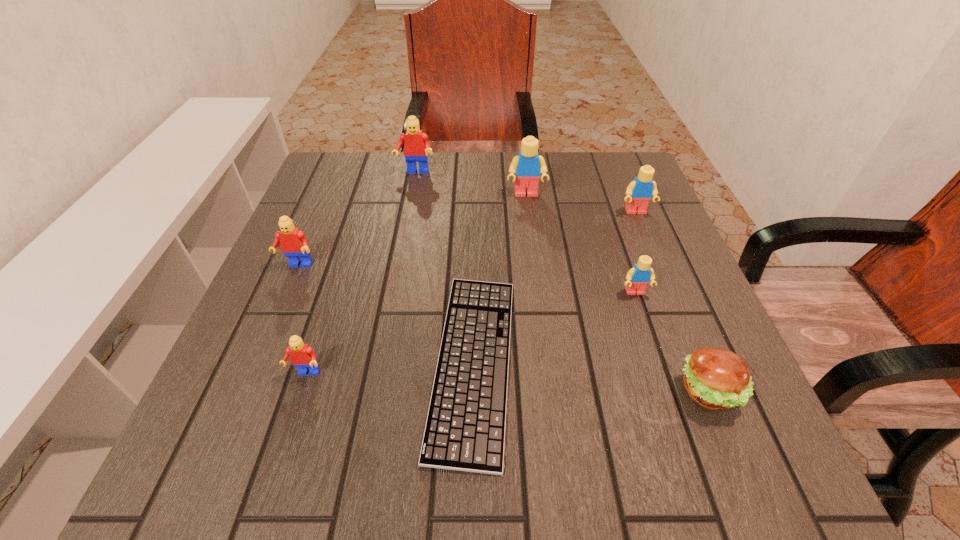
Identify the location of the nearest red Lego. This screenshot has height=540, width=960. (302, 356).

Identify the location of the second red Lego from left to right. (302, 356).

This screenshot has width=960, height=540. In order to click on hamburger in this screenshot , I will do `click(714, 378)`.

Image resolution: width=960 pixels, height=540 pixels. I want to click on computer keyboard, so click(x=465, y=428).

This screenshot has height=540, width=960. I want to click on the shortest object, so click(x=465, y=428).

Identify the location of vacant space situated 0.100m on the front-facing side of the seventh nearest object. The image size is (960, 540). (530, 226).

Identify the location of free spot located on the front-facing side of the biggest red Lego. This screenshot has height=540, width=960. (411, 195).

You are a GUI agent. You are given a task and a screenshot of the screen. Output one action in this format:
    pyautogui.click(x=<x>, y=<y>)
    Task: Click on the vacant space positioned 0.060m on the front-facing side of the fourth nearest Lego
    
    Given the screenshot: What is the action you would take?
    pyautogui.click(x=645, y=234)

Find the location of a particular element. The height and width of the screenshot is (540, 960). vacant region located 0.080m on the front-facing side of the fourth farthest Lego is located at coordinates (282, 302).

Where is `blank space located on the front-facing side of the smallest yellow Lego`? The width and height of the screenshot is (960, 540). blank space located on the front-facing side of the smallest yellow Lego is located at coordinates (660, 364).